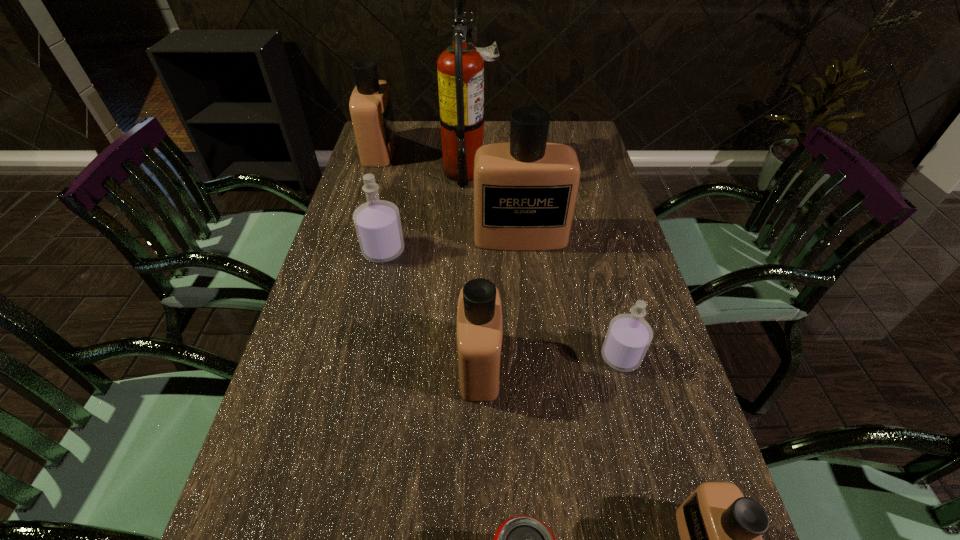
You are a GUI agent. You are given a task and a screenshot of the screen. Output one action in this format:
    pyautogui.click(x=<x>, y=<y>)
    Task: Click on the object present at the far left corner
    Image resolution: width=960 pixels, height=540 pixels.
    Given the screenshot: What is the action you would take?
    (x=370, y=106)

Where is `free space at the far edge of the desktop`? The image size is (960, 540). free space at the far edge of the desktop is located at coordinates (504, 130).

Where is `free point at the right edge`? free point at the right edge is located at coordinates (636, 274).

This screenshot has width=960, height=540. Find the location of `vacant region at the far right corner of the desktop`. vacant region at the far right corner of the desktop is located at coordinates 550,130.

This screenshot has height=540, width=960. Find the location of `vacant space in between the fire extinguisher and the third biggest beige perfume`. vacant space in between the fire extinguisher and the third biggest beige perfume is located at coordinates (475, 268).

Locate an element on the screen. The image size is (960, 540). free space that is in between the fire extinguisher and the leftmost beige perfume is located at coordinates (424, 161).

This screenshot has height=540, width=960. I want to click on vacant space that's between the right purple perfume and the leftmost beige perfume, so click(x=500, y=254).

The image size is (960, 540). Find the location of `vacant space in between the red fire extinguisher and the third farthest beige perfume`. vacant space in between the red fire extinguisher and the third farthest beige perfume is located at coordinates (475, 268).

Find the location of a particular element. The height and width of the screenshot is (540, 960). object that is the fourth closest to the red fire extinguisher is located at coordinates (479, 335).

Identify which object is the sixth closest to the right purple perfume. Please provide its 2D coordinates. Your answer should be formatted as a tuple, i.e. [(x, y)], where the tuple contains the x and y coordinates of a point satisfying the conditions above.

[(460, 68)]